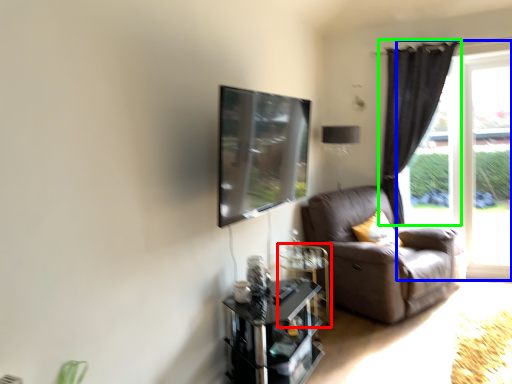
Question: Estimate the real-world distances between objects in this image. Which object is farther from glass table (highlighted by a red box), window (highlighted by a blue box) or curtain (highlighted by a green box)?

Choices:
 (A) window
 (B) curtain

Answer: (A)